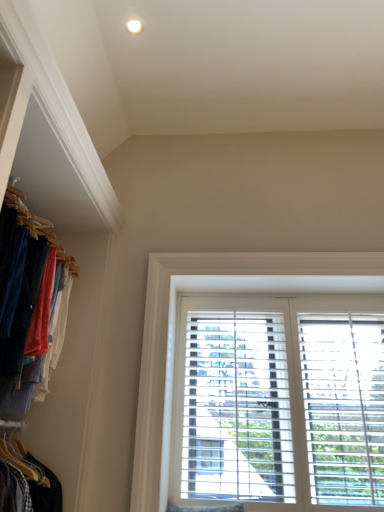
What do you see at coordinates (28, 302) in the screenshot? The width and height of the screenshot is (384, 512). I see `matte wooden hangers at left` at bounding box center [28, 302].

What is the approximate width of matte wooden hangers at left?

23.49 inches.

In order to click on matte wooden hangers at left in this screenshot , I will do `click(28, 302)`.

Measure the distance between point (180,280) and camera.

7.95 feet.

Image resolution: width=384 pixels, height=512 pixels. Identify the location of white wooden blinds at center. (174, 331).

Describe the element at coordinates (174, 331) in the screenshot. I see `white wooden blinds at center` at that location.

What is the approximate height of white wooden blinds at center?

The height of white wooden blinds at center is 1.19 meters.

This screenshot has height=512, width=384. I want to click on matte wooden hangers at left, so click(x=28, y=302).

Considering the positions of objects white wooden blinds at center and matte wooden hangers at left in the image provided, who is more to the left, white wooden blinds at center or matte wooden hangers at left?

Positioned to the left is matte wooden hangers at left.

In the image, is white wooden blinds at center positioned in front of or behind matte wooden hangers at left?

white wooden blinds at center is positioned farther from the viewer than matte wooden hangers at left.

Which is nearer, (214, 258) or (39, 281)?

Point (214, 258).

From the image's perspective, which is above, white wooden blinds at center or matte wooden hangers at left?

matte wooden hangers at left.

From a real-world perspective, is white wooden blinds at center positioned over matte wooden hangers at left based on gravity?

No, from a real-world perspective, white wooden blinds at center is not over matte wooden hangers at left

Which object is wider, white wooden blinds at center or matte wooden hangers at left?

With larger width is matte wooden hangers at left.

Considering the sizes of objects white wooden blinds at center and matte wooden hangers at left in the image provided, who is shorter, white wooden blinds at center or matte wooden hangers at left?

With less height is matte wooden hangers at left.

Is white wooden blinds at center smaller than matte wooden hangers at left?

Yes, white wooden blinds at center is smaller than matte wooden hangers at left.

Which is correct: white wooden blinds at center is inside matte wooden hangers at left, or outside of it?

The correct answer is: outside.

Does white wooden blinds at center touch matte wooden hangers at left?

They are not placed beside each other.

Is white wooden blinds at center facing towards matte wooden hangers at left?

No, white wooden blinds at center does not turn towards matte wooden hangers at left.

How different are the orientations of white wooden blinds at center and matte wooden hangers at left in degrees?

90.2 degrees.

Image resolution: width=384 pixels, height=512 pixels. I want to click on closet above the white wooden blinds at center (from a real-world perspective), so click(x=28, y=302).

Which object is positioned more to the right, matte wooden hangers at left or white wooden blinds at center?

white wooden blinds at center is more to the right.

Which object is closer to the camera taking this photo, matte wooden hangers at left or white wooden blinds at center?

matte wooden hangers at left is closer to the camera.

Does point (44, 273) come farther from viewer compared to point (166, 487)?

No, it is not.

From the picture: From the image's perspective, is matte wooden hangers at left above or below white wooden blinds at center?

matte wooden hangers at left is above white wooden blinds at center.

From a real-world perspective, is matte wooden hangers at left located higher than white wooden blinds at center?

Yes, from a real-world perspective, matte wooden hangers at left is over white wooden blinds at center

Is matte wooden hangers at left wider or thinner than white wooden blinds at center?

matte wooden hangers at left is wider than white wooden blinds at center.

Based on the photo, which of these two, matte wooden hangers at left or white wooden blinds at center, stands shorter?

Standing shorter between the two is matte wooden hangers at left.

Which of these two, matte wooden hangers at left or white wooden blinds at center, is bigger?

Bigger between the two is matte wooden hangers at left.

Is matte wooden hangers at left inside or outside of white wooden blinds at center?

matte wooden hangers at left is located beyond the bounds of white wooden blinds at center.

From the picture: Is matte wooden hangers at left beside white wooden blinds at center?

No, matte wooden hangers at left is not in contact with white wooden blinds at center.

Is matte wooden hangers at left oriented towards white wooden blinds at center?

Yes, matte wooden hangers at left is turned towards white wooden blinds at center.

Locate an element on the screen. closet above the white wooden blinds at center (from a real-world perspective) is located at coordinates (28, 302).

Find the location of a particular element. window on the right of matte wooden hangers at left is located at coordinates (174, 331).

You are a GUI agent. You are given a task and a screenshot of the screen. Output one action in this format:
    pyautogui.click(x=<x>, y=<y>)
    Task: Click on the closet in front of the white wooden blinds at center
    This screenshot has height=512, width=384.
    Given the screenshot: What is the action you would take?
    pyautogui.click(x=28, y=302)